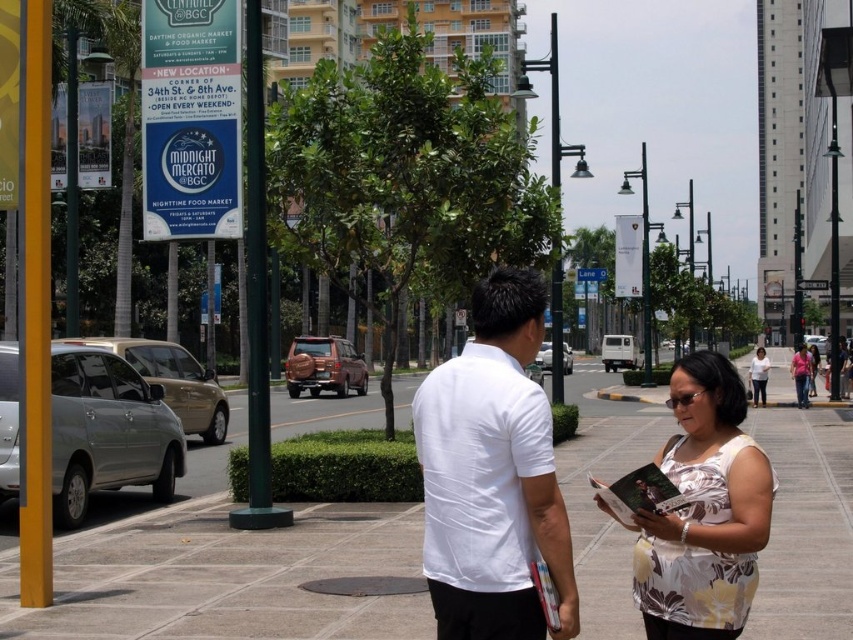
Question: Is gray concrete pavement at center to the right of white matte shirt at center from the viewer's perspective?

Choices:
 (A) no
 (B) yes

Answer: (B)

Question: Can you confirm if gray concrete pavement at center is smaller than white floral tank top at right?

Choices:
 (A) no
 (B) yes

Answer: (A)

Question: Which of these objects is positioned farthest from the blue plastic sign at center?

Choices:
 (A) white floral tank top at right
 (B) white plastic street sign at center
 (C) gray concrete pavement at center
 (D) white matte shirt at center

Answer: (A)

Question: Which point is farther to the camera?

Choices:
 (A) (821, 288)
 (B) (752, 513)
 (C) (590, 278)

Answer: (C)

Question: Does white matte shirt at center lie in front of white floral tank top at right?

Choices:
 (A) no
 (B) yes

Answer: (B)

Question: Which of the following is the farthest from the observer?

Choices:
 (A) blue plastic sign at center
 (B) white plastic street sign at center
 (C) white floral tank top at right

Answer: (A)